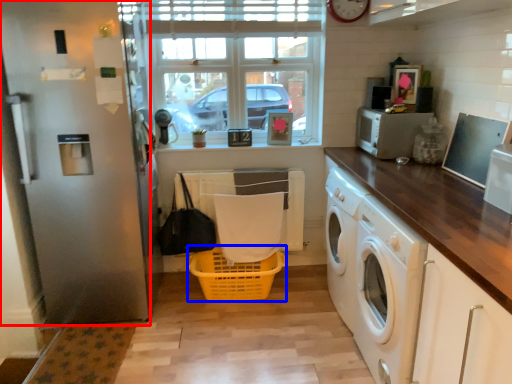
Question: Among these objects, which one is farthest to the camera, screen door (highlighted by a red box) or basket (highlighted by a blue box)?

Choices:
 (A) screen door
 (B) basket

Answer: (B)